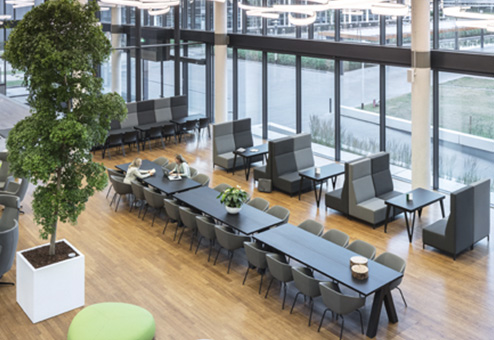
Where is `tables`? The height and width of the screenshot is (340, 494). tables is located at coordinates (125, 129), (145, 124), (182, 119), (261, 148), (329, 167), (424, 195), (303, 245), (205, 200), (166, 180).